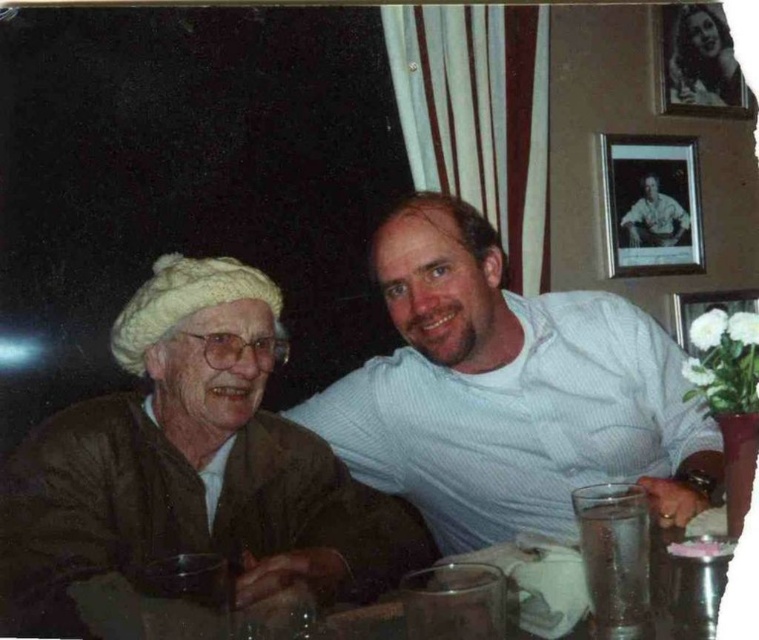
Question: Is matte white shirt at upper right smaller than white matte picture frame at upper right?

Choices:
 (A) yes
 (B) no

Answer: (A)

Question: Does matte white shirt at upper right appear under white matte picture frame at upper right?

Choices:
 (A) yes
 (B) no

Answer: (B)

Question: Which point appears closest to the camera in this image?

Choices:
 (A) (726, 307)
 (B) (191, 547)
 (C) (468, 408)

Answer: (B)

Question: Does white woolen hat at upper left appear under black matte picture frame at upper right?

Choices:
 (A) no
 (B) yes

Answer: (B)

Question: Which of these objects is positioned closest to the matte white shirt at upper right?

Choices:
 (A) black matte picture frame at upper right
 (B) smooth glossy portrait at upper right
 (C) white woolen hat at upper left

Answer: (A)

Question: Which point is farther to the camera?

Choices:
 (A) (635, 205)
 (B) (745, 104)
 (C) (10, 547)

Answer: (B)